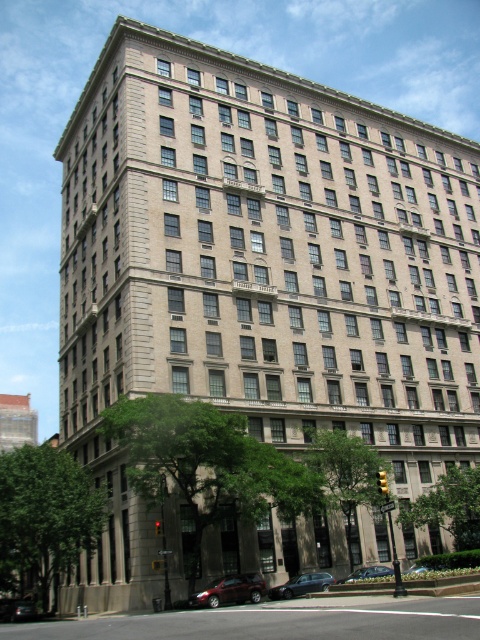
Question: Estimate the real-world distances between objects in this image. Which object is closer to the metallic silver sedan at center?

Choices:
 (A) shiny maroon sedan at lower center
 (B) metallic red car at lower left
 (C) shiny black sedan at lower center
 (D) metallic silver sedan at lower center

Answer: (D)

Question: Estimate the real-world distances between objects in this image. Which object is farther from the metallic silver sedan at center?

Choices:
 (A) shiny maroon sedan at lower center
 (B) metallic red car at lower left
 (C) shiny black sedan at lower center
 (D) metallic silver sedan at lower center

Answer: (B)

Question: Is shiny maroon sedan at lower center thinner than shiny black sedan at lower center?

Choices:
 (A) yes
 (B) no

Answer: (B)

Question: Estimate the real-world distances between objects in this image. Which object is closer to the shiny maroon sedan at lower center?

Choices:
 (A) metallic silver sedan at center
 (B) metallic silver sedan at lower center

Answer: (B)

Question: Is shiny maroon sedan at lower center behind metallic red car at lower left?

Choices:
 (A) no
 (B) yes

Answer: (A)

Question: Is shiny maroon sedan at lower center above metallic silver sedan at center?

Choices:
 (A) no
 (B) yes

Answer: (B)